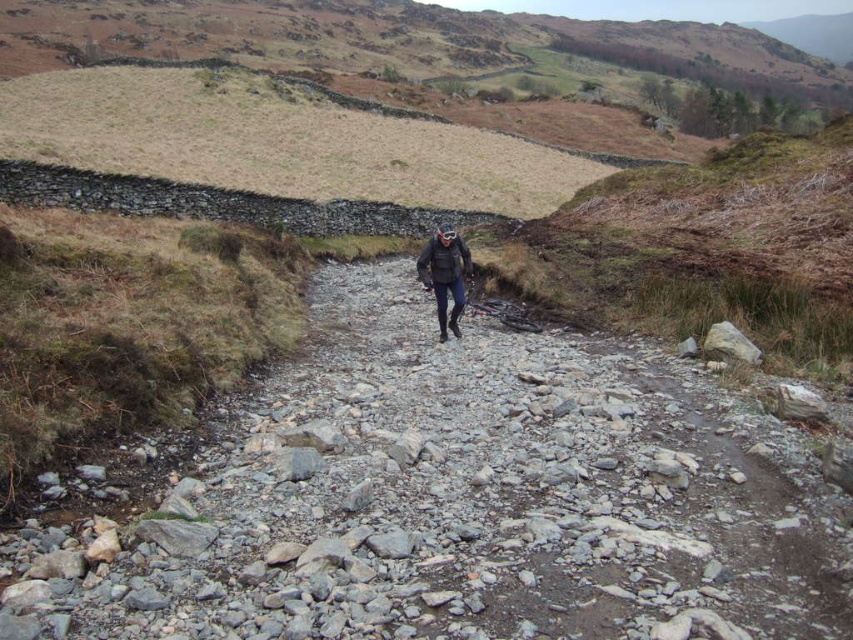
Question: Which of the following is the closest to the observer?

Choices:
 (A) (428, 253)
 (B) (695, 497)

Answer: (B)

Question: Does gray rocky trail at center appear over dark gray jacket at center?

Choices:
 (A) no
 (B) yes

Answer: (A)

Question: Which of the following is the closest to the observer?

Choices:
 (A) (386, 422)
 (B) (436, 280)

Answer: (A)

Question: Is gray rocky trail at center above dark gray jacket at center?

Choices:
 (A) no
 (B) yes

Answer: (A)

Question: Which object appears farthest from the camera in this image?

Choices:
 (A) gray rocky trail at center
 (B) dark gray jacket at center

Answer: (B)

Question: Is gray rocky trail at center positioned in front of dark gray jacket at center?

Choices:
 (A) no
 (B) yes

Answer: (B)